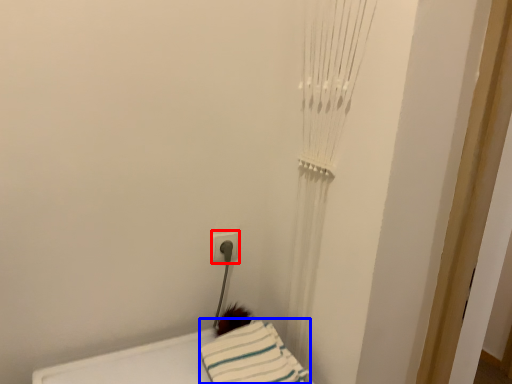
Question: Which object is closer to the camera taking this photo, electric outlet (highlighted by a red box) or sheet (highlighted by a blue box)?

Choices:
 (A) electric outlet
 (B) sheet

Answer: (B)